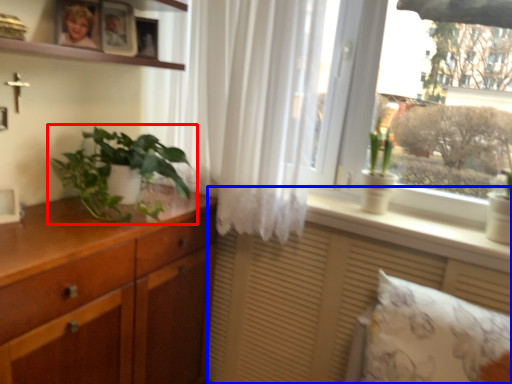
Question: Which of the following is the farthest to the observer, houseplant (highlighted by a red box) or vanity (highlighted by a blue box)?

Choices:
 (A) houseplant
 (B) vanity

Answer: (B)